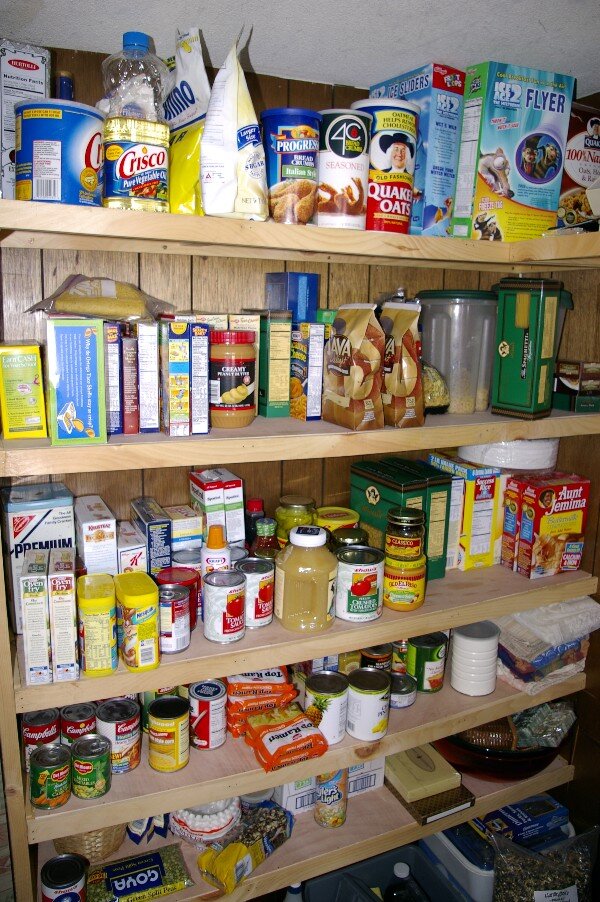
I want to click on pantry shelves, so click(175, 227), click(169, 452), click(297, 646), click(219, 787), click(331, 858).